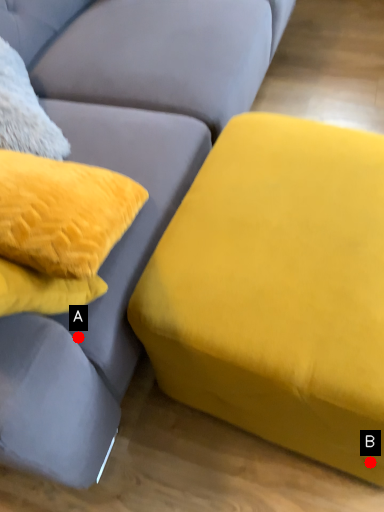
Question: Two points are circled on the image, labeled by A and B beside each circle. Which point is farther from the camera taking this photo?

Choices:
 (A) A is further
 (B) B is further

Answer: (B)